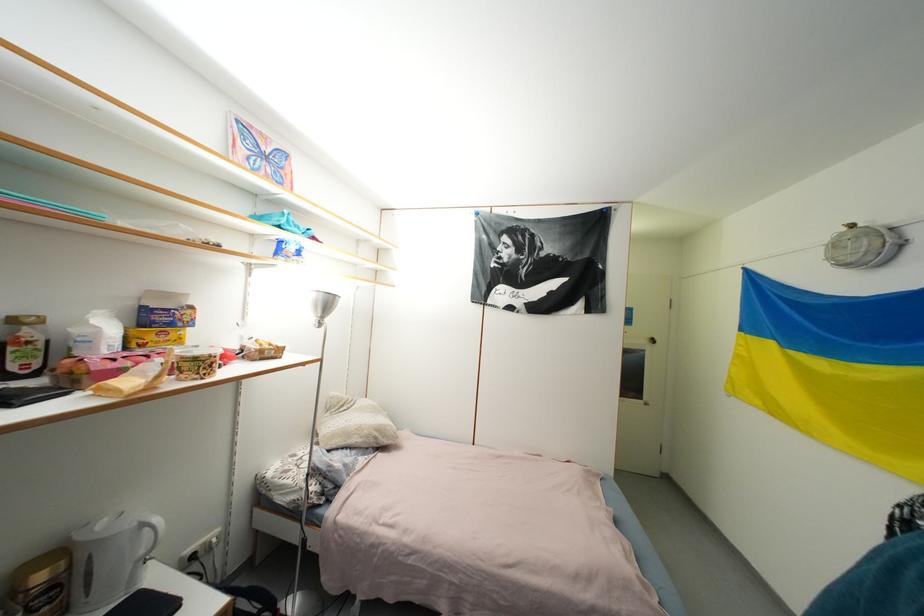
I want to click on white kettle handle, so click(x=152, y=533).